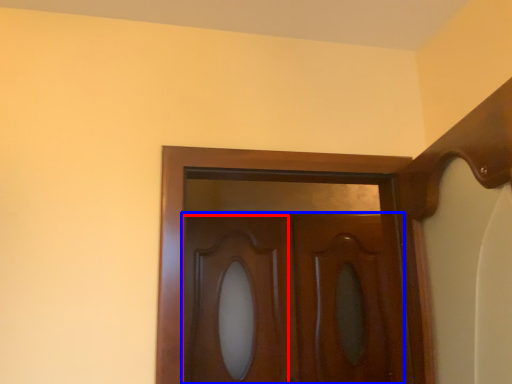
Question: Which of the following is the closest to the observer, cabinetry (highlighted by a red box) or door (highlighted by a blue box)?

Choices:
 (A) cabinetry
 (B) door

Answer: (B)